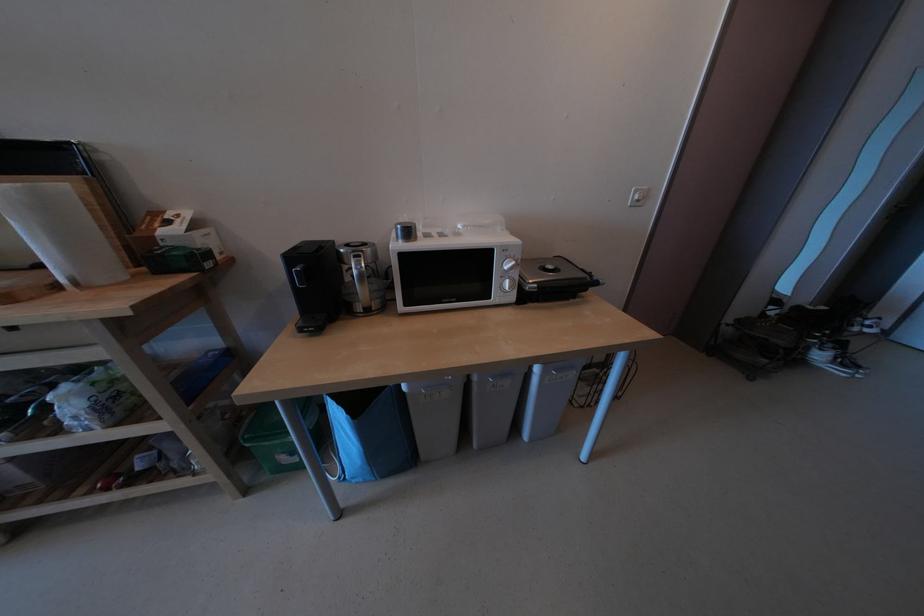
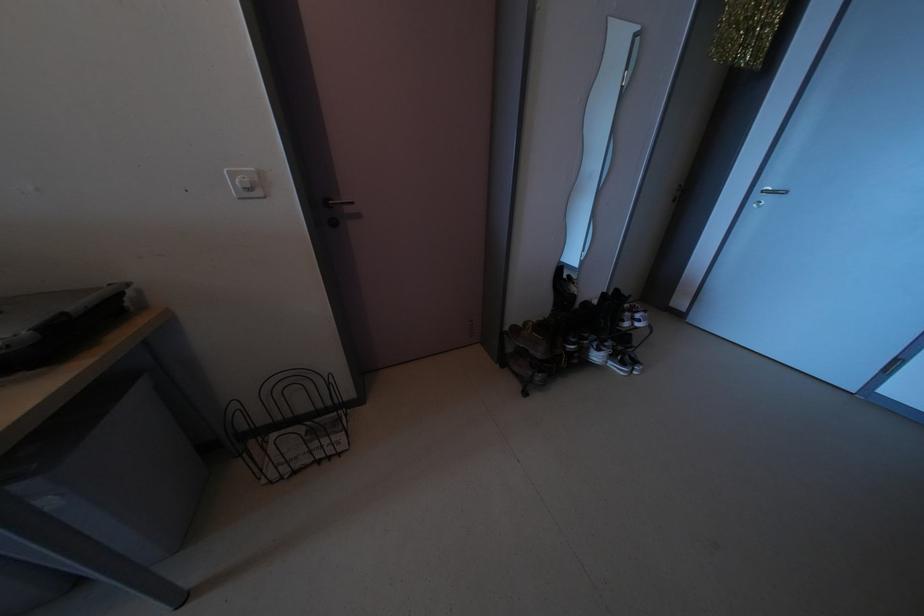
Question: What movement of the cameraman would produce the second image?

Choices:
 (A) Left
 (B) Right
 (C) Forward
 (D) Backward

Answer: (B)